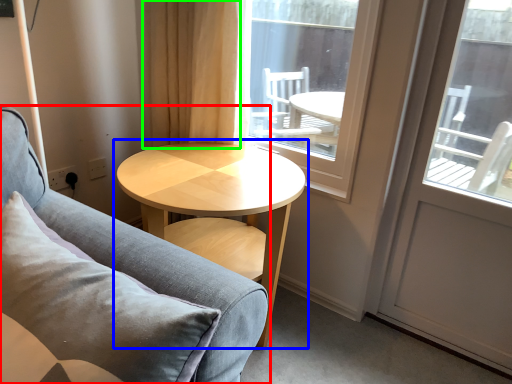
Question: Which object is the farthest from studio couch (highlighted by a red box)? Choose among these: coffee table (highlighted by a blue box) or curtain (highlighted by a green box).

Choices:
 (A) coffee table
 (B) curtain

Answer: (B)